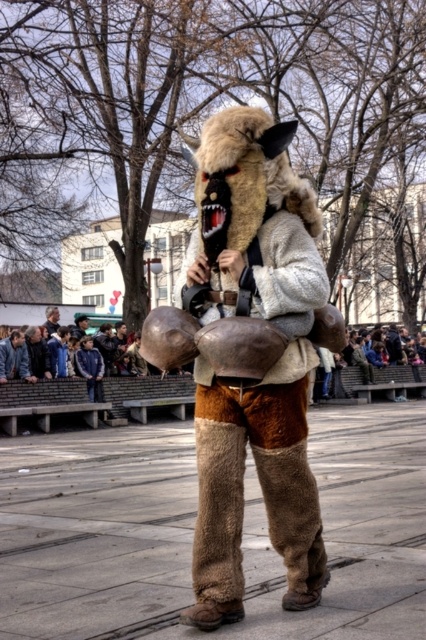
Does furry costume at center appear under dark gray fabric jacket at lower left?

Yes.

Does furry costume at center have a greater height compared to dark gray fabric jacket at lower left?

Yes.

Is point (192, 304) farther from viewer compared to point (45, 323)?

That is False.

Find the location of a particular element. furry costume at center is located at coordinates (265, 371).